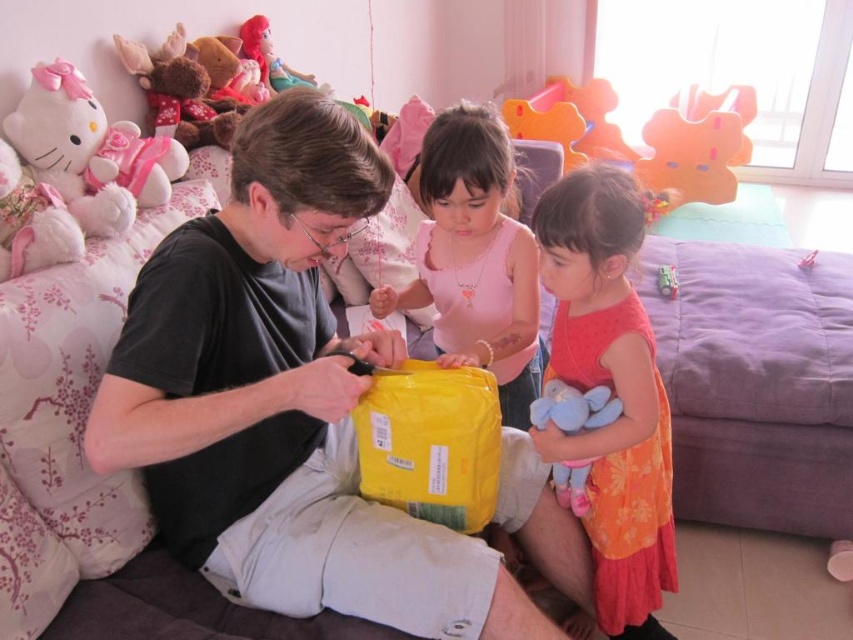
Between point (560, 216) and point (662, 282), which one is positioned behind?

The point (662, 282) is more distant.

Who is positioned more to the right, orange floral dress at center or matte plastic toy at center?

Positioned to the right is matte plastic toy at center.

At what (x,y) coordinates should I click in order to perform the action: click on orange floral dress at center. Please return your answer as a coordinate pair (x, y). The image size is (853, 640). Looking at the image, I should click on (611, 392).

Does point (538, 321) come closer to viewer compared to point (280, 67)?

That is True.

Describe the element at coordinates (474, 259) in the screenshot. Image resolution: width=853 pixels, height=640 pixels. I see `matte yellow plastic bag at center` at that location.

This screenshot has height=640, width=853. Describe the element at coordinates (474, 259) in the screenshot. I see `matte yellow plastic bag at center` at that location.

I want to click on matte yellow plastic bag at center, so pos(474,259).

Is point (244, 304) positioned in front of point (583, 410)?

That is True.

Based on the photo, does black matte shirt at center have a lesser width compared to soft plush toy at lower right?

No, black matte shirt at center is not thinner than soft plush toy at lower right.

Locate an element on the screen. black matte shirt at center is located at coordinates [x=282, y=400].